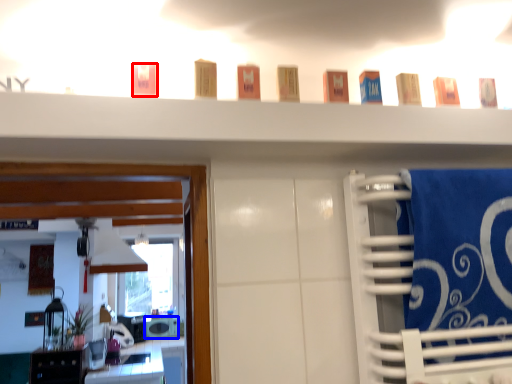
Question: Which object is further to the camera taking this photo, toiletry (highlighted by a red box) or appliance (highlighted by a blue box)?

Choices:
 (A) toiletry
 (B) appliance

Answer: (B)